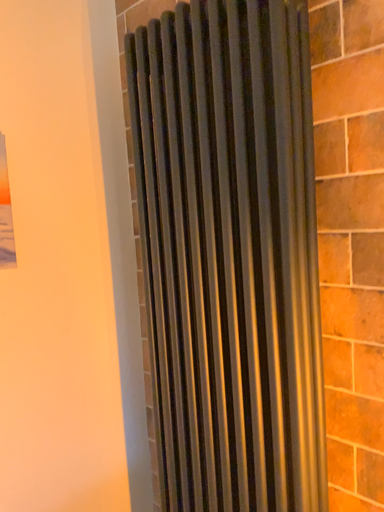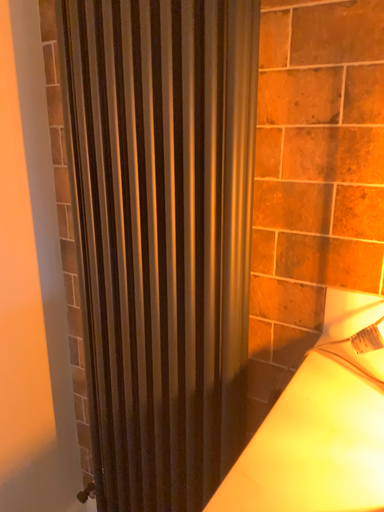
Question: Which way did the camera rotate in the video?

Choices:
 (A) rotated downward
 (B) rotated upward

Answer: (A)